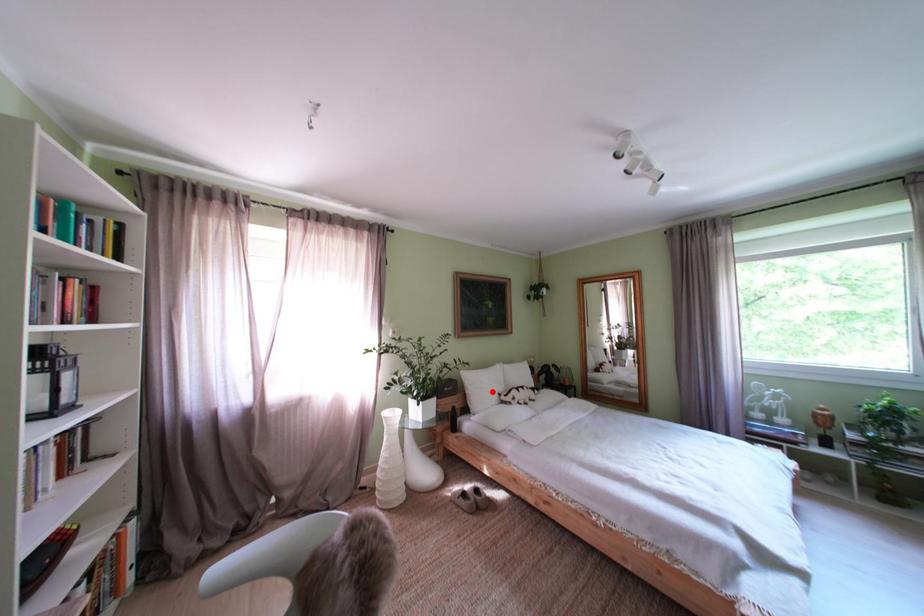
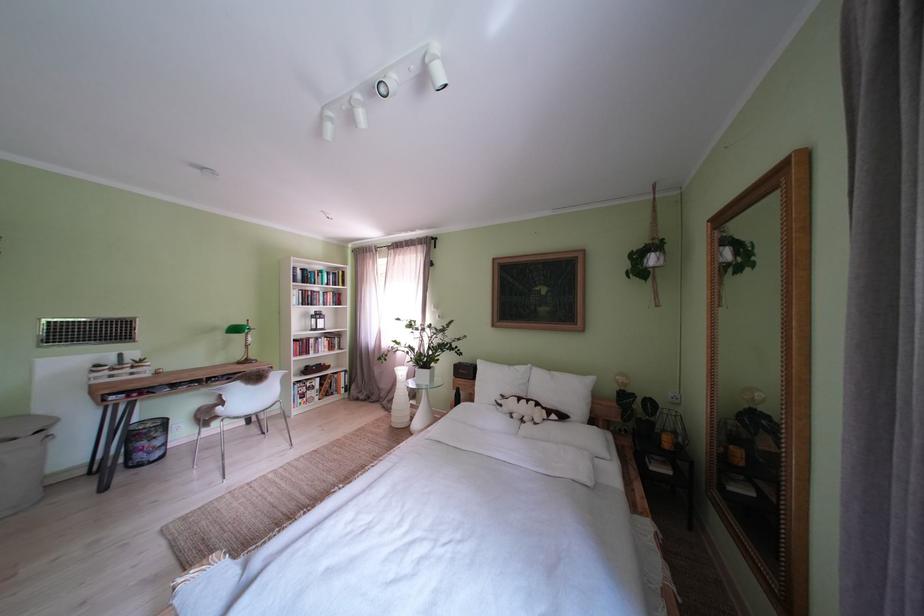
The point at the highlighted location is marked in the first image. Where is the corresponding point in the second image?

(500, 386)